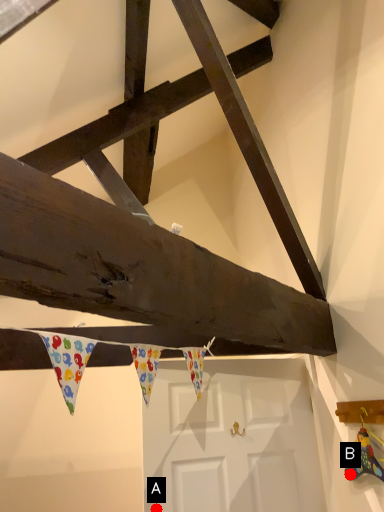
Question: Two points are circled on the image, labeled by A and B beside each circle. Among these points, which one is farthest from the camera?

Choices:
 (A) A is further
 (B) B is further

Answer: (A)